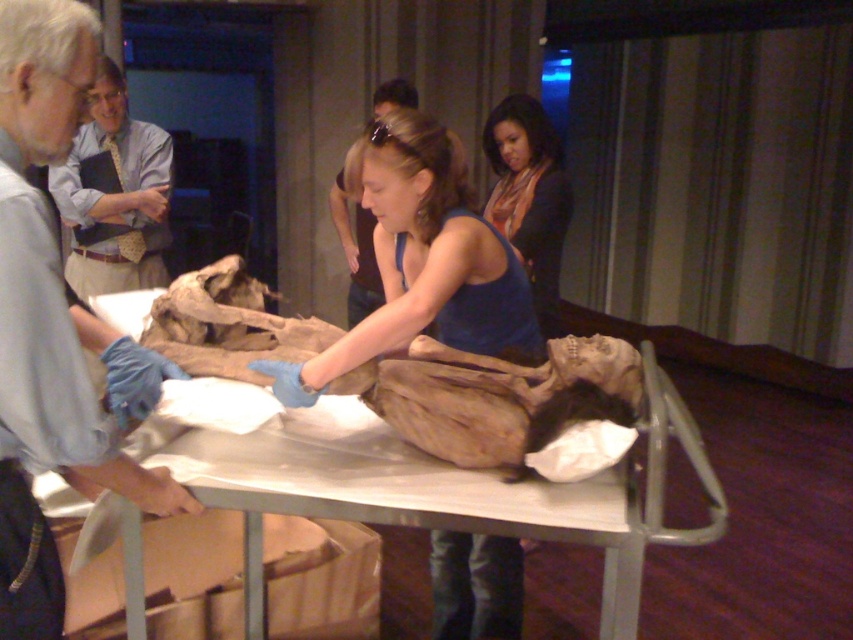
Does light blue shirt at upper left have a larger size compared to matte blue tank top at center?

Yes, light blue shirt at upper left is bigger than matte blue tank top at center.

Does point (62, 186) come behind point (538, 132)?

Yes, it is.

Image resolution: width=853 pixels, height=640 pixels. What do you see at coordinates (115, 195) in the screenshot?
I see `light blue shirt at upper left` at bounding box center [115, 195].

I want to click on light blue shirt at upper left, so click(115, 195).

Is gray fabric apron at left wider than blue latex glove at center?

Correct, the width of gray fabric apron at left exceeds that of blue latex glove at center.

Who is positioned more to the left, gray fabric apron at left or blue latex glove at center?

gray fabric apron at left

Which is in front, point (0, 403) or point (337, 214)?

Point (0, 403) is in front.

Locate an element on the screen. The width and height of the screenshot is (853, 640). gray fabric apron at left is located at coordinates (54, 323).

Who is lower down, blue fabric shirt at center or blue latex glove at center?

blue fabric shirt at center is lower down.

Between blue fabric shirt at center and blue latex glove at center, which one has less height?

With less height is blue fabric shirt at center.

Find the location of `blue fabric shirt at center`. blue fabric shirt at center is located at coordinates (422, 260).

This screenshot has height=640, width=853. Identify the location of blue fabric shirt at center. (422, 260).